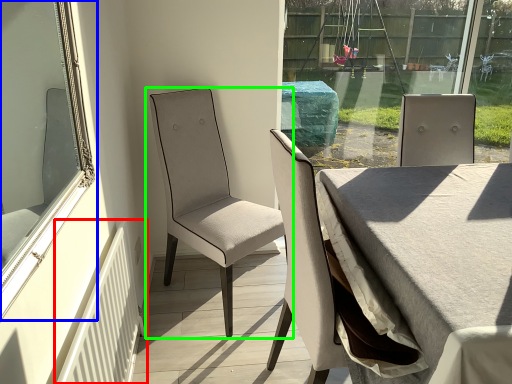
Question: Based on their relative distances, which object is nearer to radiator (highlighted by a red box)? Choose from window (highlighted by a blue box) and chair (highlighted by a green box).

Choices:
 (A) window
 (B) chair

Answer: (A)